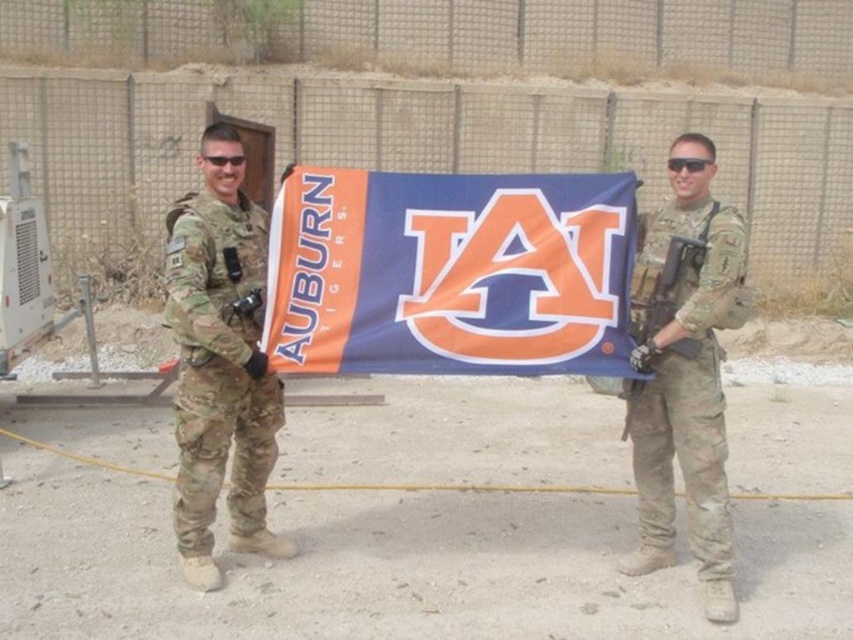
You are a photographer who needs to capture a closeup shot of the blue fabric flag at center and the matte black rifle at right. Which object should you zoom in on first to ensure both are in focus?

The blue fabric flag at center is wider than the matte black rifle at right, so you should zoom in on the blue fabric flag at center first to ensure both are in focus.

You are a photographer positioned between the two individuals wearing camouflage fabric uniforms. You need to capture a photo where both are in focus. Given that your camera has a depth of field that can sharply focus on objects within a 5.5 feet range, will both the camouflage fabric uniform at left and the camouflage fabric uniform at right be in focus?

The camouflage fabric uniform at left is 5.75 feet away from the camouflage fabric uniform at right. Since the distance between them exceeds the camera lens depth of field range of 5.5 feet, both uniforms will not be in focus simultaneously.

Looking at this image, based on the coordinates provided, which object is exactly at point (685, 380)?

The camouflage fabric uniform at right is exactly at point (685, 380).